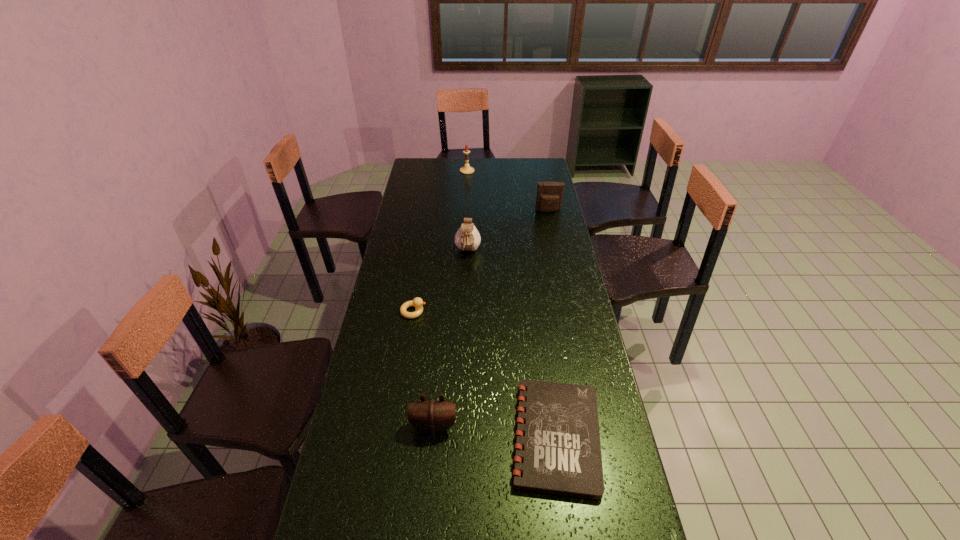
Locate an element on the screen. The image size is (960, 540). vacant space at the left edge is located at coordinates (404, 244).

The height and width of the screenshot is (540, 960). I want to click on vacant space at the right edge of the desktop, so click(524, 181).

At what (x,y) coordinates should I click in order to perform the action: click on vacant space at the far left corner. Please return your answer as a coordinate pair (x, y). Looking at the image, I should click on (411, 160).

At what (x,y) coordinates should I click in order to perform the action: click on vacant area at the far right corner of the desktop. Please return your answer as a coordinate pair (x, y). The height and width of the screenshot is (540, 960). Looking at the image, I should click on (527, 158).

The width and height of the screenshot is (960, 540). What are the coordinates of `free space between the nearest pouch and the shortest object` in the screenshot? It's located at (495, 431).

The image size is (960, 540). What are the coordinates of `vacant area that lies between the candle and the shortest object` in the screenshot? It's located at (512, 303).

I want to click on empty location between the nearest pouch and the third nearest object, so click(x=423, y=369).

Locate an element on the screen. vacant space that's between the nearest pouch and the duckling is located at coordinates (423, 369).

You are a GUI agent. You are given a task and a screenshot of the screen. Output one action in this format:
    pyautogui.click(x=<x>, y=<y>)
    Task: Click on the free space between the candle and the fifth nearest object
    
    Given the screenshot: What is the action you would take?
    pyautogui.click(x=508, y=191)

Find the location of a particular element. blank region between the candle and the duckling is located at coordinates (441, 241).